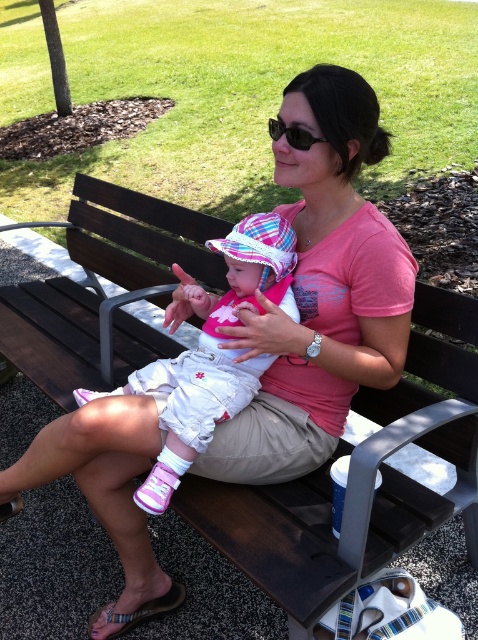
Between brown wooden bench at center and black plastic sunglasses at center, which one has less height?

black plastic sunglasses at center

Is point (169, 221) behind point (278, 132)?

Yes, it is.

Locate an element on the screen. Image resolution: width=478 pixels, height=640 pixels. brown wooden bench at center is located at coordinates (273, 538).

Does pink fabric baby at center have a smaller size compared to black plastic sunglasses at center?

No, pink fabric baby at center is not smaller than black plastic sunglasses at center.

Image resolution: width=478 pixels, height=640 pixels. What are the coordinates of `pink fabric baby at center` in the screenshot? It's located at (213, 353).

Is point (257, 369) farther from camera compared to point (278, 129)?

Yes, point (257, 369) is behind point (278, 129).

Find the location of `pink fabric baby at center`. pink fabric baby at center is located at coordinates (213, 353).

Does brown wooden bench at center have a larger size compared to pink fabric baby at center?

Correct, brown wooden bench at center is larger in size than pink fabric baby at center.

Is point (412, 336) less distant than point (203, 326)?

Yes, it is in front of point (203, 326).

You are a GUI agent. You are given a task and a screenshot of the screen. Output one action in this format:
    pyautogui.click(x=<x>, y=<y>)
    Task: Click on the brown wooden bench at center
    The width and height of the screenshot is (478, 640).
    Given the screenshot: What is the action you would take?
    pyautogui.click(x=273, y=538)